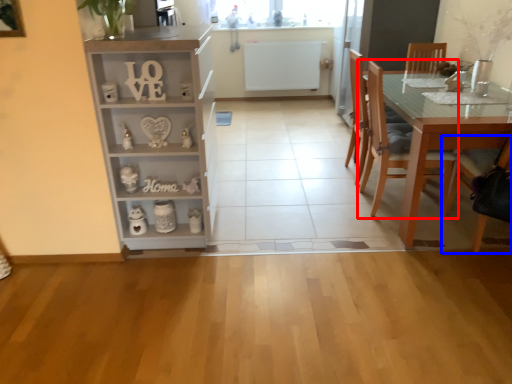
Question: Which object appears closest to the camera in this image, chair (highlighted by a red box) or chair (highlighted by a blue box)?

Choices:
 (A) chair
 (B) chair

Answer: (B)